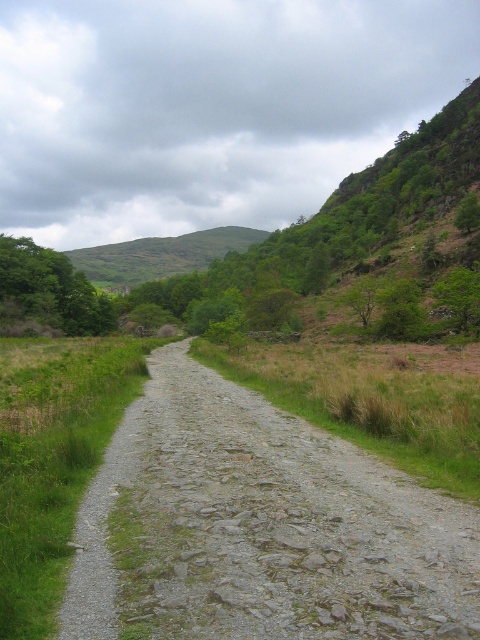
Does gray gravel trail at center have a greater width compared to green grassy hillside at upper center?

No, gray gravel trail at center is not wider than green grassy hillside at upper center.

Is point (394, 512) closer to viewer compared to point (184, 236)?

Yes, point (394, 512) is in front of point (184, 236).

Identify the location of gray gravel trail at center. The image size is (480, 640). (260, 528).